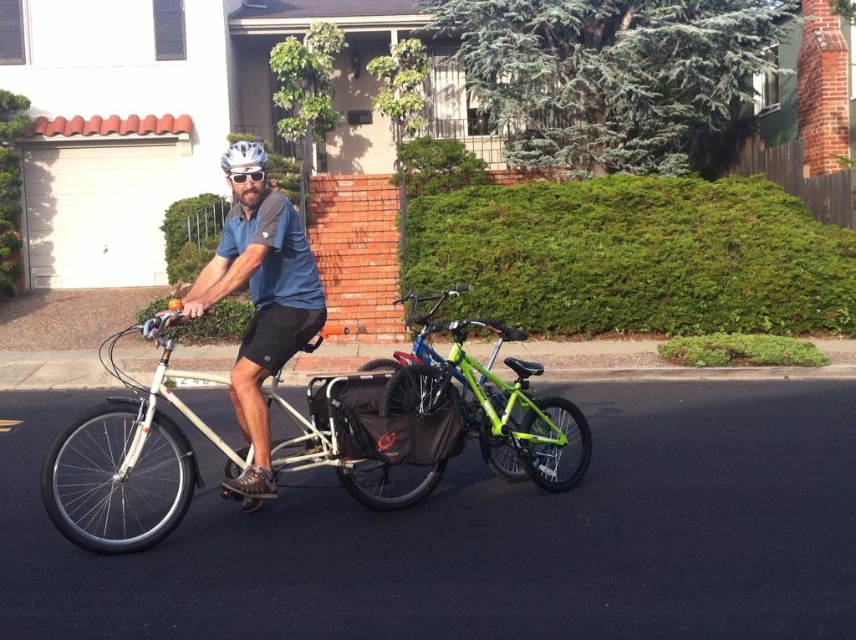
Who is taller, green matte bicycle at center or white matte bicycle helmet at center?

white matte bicycle helmet at center

Between green matte bicycle at center and white matte bicycle helmet at center, which one appears on the right side from the viewer's perspective?

Positioned to the right is green matte bicycle at center.

Does point (423, 317) come farther from viewer compared to point (259, 168)?

Yes.

Locate an element on the screen. The width and height of the screenshot is (856, 640). green matte bicycle at center is located at coordinates (498, 400).

Which is in front, point (467, 396) or point (233, 164)?

Point (233, 164)

Does green matte bicycle at center appear under white matte helmet at center?

Correct, green matte bicycle at center is located below white matte helmet at center.

Find the location of a particular element. This screenshot has height=640, width=856. green matte bicycle at center is located at coordinates (498, 400).

Does point (275, 396) lie in front of point (260, 182)?

No, (275, 396) is behind (260, 182).

Based on the photo, who is more forward, (191, 492) or (239, 209)?

Positioned in front is point (191, 492).

You are a GUI agent. You are given a task and a screenshot of the screen. Output one action in this format:
    pyautogui.click(x=<x>, y=<y>)
    Task: Click on the white matte bicycle at center
    The width and height of the screenshot is (856, 640).
    Given the screenshot: What is the action you would take?
    pyautogui.click(x=129, y=454)